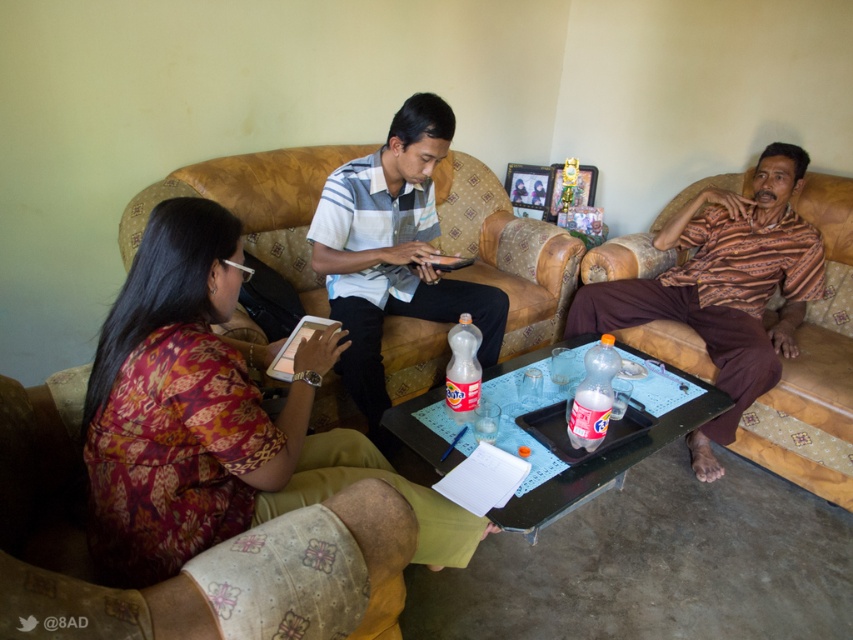
Does batik-patterned shirt at right have a greater width compared to striped cotton shirt at center?

Yes.

Is batik-patterned shirt at right to the left of striped cotton shirt at center from the viewer's perspective?

No, batik-patterned shirt at right is not to the left of striped cotton shirt at center.

Where is `batik-patterned shirt at right`? batik-patterned shirt at right is located at coordinates (724, 288).

Where is `batik-patterned shirt at right`? batik-patterned shirt at right is located at coordinates (724, 288).

Between batik fabric at lower left and striped cotton shirt at center, which one appears on the right side from the viewer's perspective?

From the viewer's perspective, striped cotton shirt at center appears more on the right side.

Which is in front, point (222, 561) or point (409, 115)?

Positioned in front is point (222, 561).

Does point (267, 611) come behind point (317, 244)?

No, (267, 611) is in front of (317, 244).

Where is `batik fabric at lower left`? batik fabric at lower left is located at coordinates (231, 580).

Who is more forward, (469, 244) or (722, 369)?

Point (722, 369) is in front.

Does leather couch at center have a greater width compared to batik-patterned shirt at right?

No, leather couch at center is not wider than batik-patterned shirt at right.

Is point (120, 250) positioned after point (689, 237)?

No.

Locate an element on the screen. This screenshot has height=640, width=853. leather couch at center is located at coordinates (506, 252).